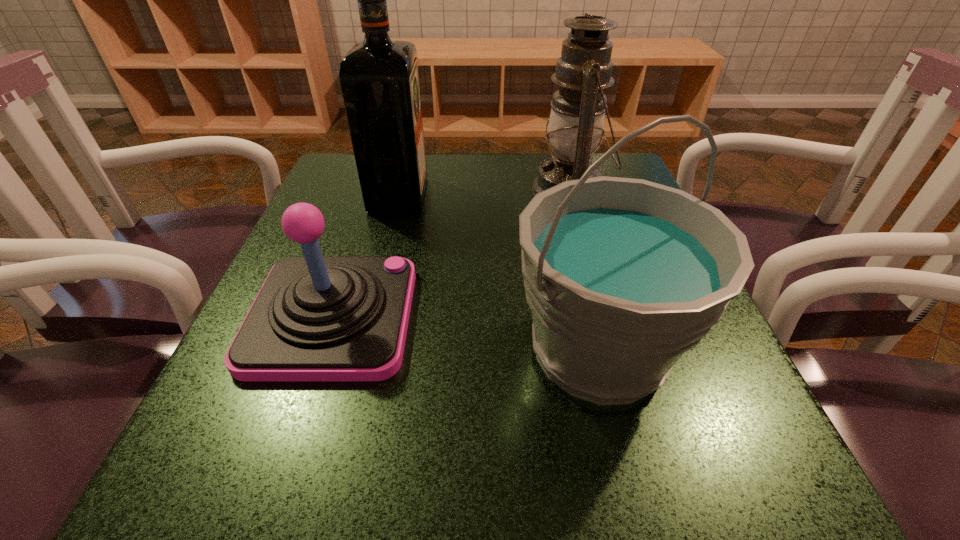
In order to click on liquor in this screenshot , I will do 379,77.

This screenshot has height=540, width=960. In order to click on oil lamp in this screenshot , I will do point(576,122).

What are the coordinates of `bucket` in the screenshot? It's located at (623, 276).

Find the location of a particular element. joystick is located at coordinates (315, 318).

This screenshot has width=960, height=540. I want to click on free location located on the front label of the liquor, so click(483, 195).

I want to click on free location located 0.350m on the front of the oil lamp, so click(617, 355).

The image size is (960, 540). I want to click on vacant space located 0.050m on the back of the bucket, so click(579, 270).

Where is `vacant space situated forward from the base of the shortest object`? The width and height of the screenshot is (960, 540). vacant space situated forward from the base of the shortest object is located at coordinates (551, 317).

Find the location of a particular element. liquor that is at the far edge is located at coordinates (379, 77).

You are a GUI agent. You are given a task and a screenshot of the screen. Output one action in this format:
    pyautogui.click(x=<x>, y=<y>)
    Task: Click on the oil lamp that is at the far edge
    This screenshot has height=540, width=960.
    Given the screenshot: What is the action you would take?
    tap(576, 122)